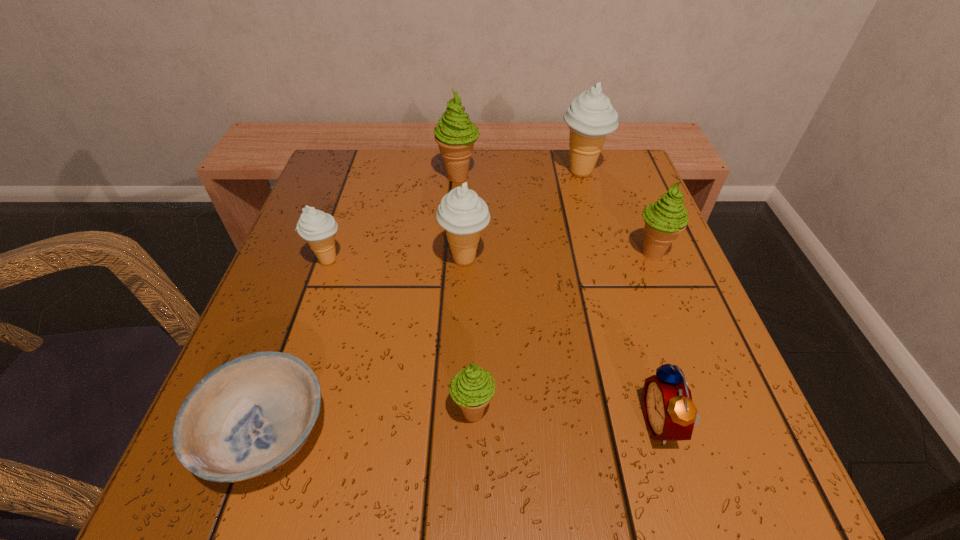
Locate which green icecream ranks third in proximity to the rightmost beige icecream. Please provide its 2D coordinates. Your answer should be formatted as a tuple, i.e. [(x, y)], where the tuple contains the x and y coordinates of a point satisfying the conditions above.

[(472, 388)]

You are a GUI agent. You are given a task and a screenshot of the screen. Output one action in this format:
    pyautogui.click(x=<x>, y=<y>)
    Task: Click on the green icecream that is the second nearest to the second farthest green icecream
    This screenshot has height=540, width=960.
    Given the screenshot: What is the action you would take?
    pyautogui.click(x=472, y=388)

Where is `beige icecream that is the nearest to the nearest icecream`? The image size is (960, 540). beige icecream that is the nearest to the nearest icecream is located at coordinates (462, 213).

I want to click on beige icecream that is the third closest to the bowl, so click(x=590, y=117).

This screenshot has width=960, height=540. Find the location of `vacant space that satisfies the following two spatial constraints: 1. on the front-facing side of the alarm clock; 2. on the front side of the blue bowl`. vacant space that satisfies the following two spatial constraints: 1. on the front-facing side of the alarm clock; 2. on the front side of the blue bowl is located at coordinates (665, 434).

The width and height of the screenshot is (960, 540). Identify the location of vacant position in the image that satisfies the following two spatial constraints: 1. on the back side of the farthest green icecream; 2. on the right side of the rightmost beige icecream. (459, 172).

In order to click on vacant space that satisfies the following two spatial constraints: 1. on the front side of the rightmost green icecream; 2. on the left side of the biggest green icecream in this screenshot , I will do `click(454, 254)`.